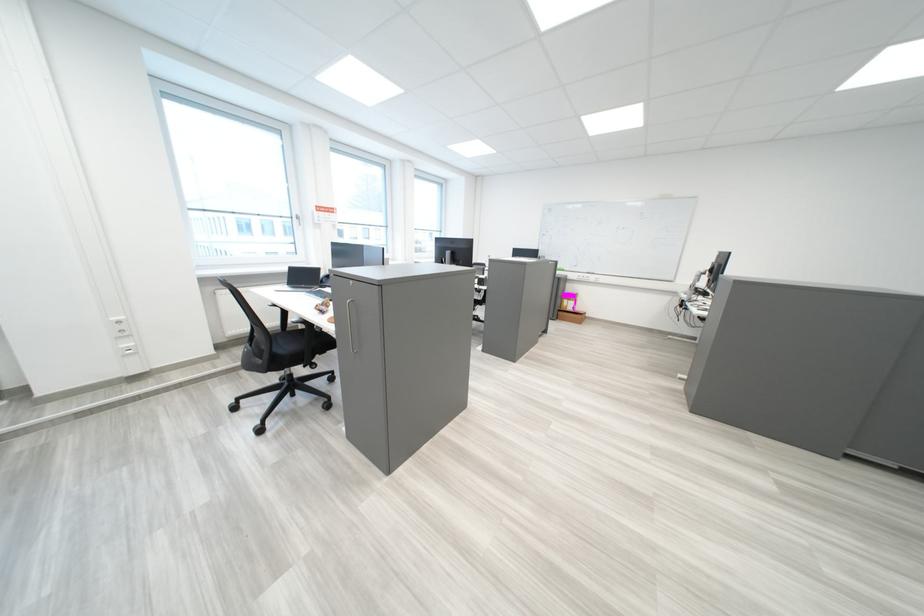
At what (x,y) coordinates should I click in order to perform the action: click on black chair armrest. Please return your answer as a coordinate pair (x, y). The image size is (924, 616). Looking at the image, I should click on (297, 323).